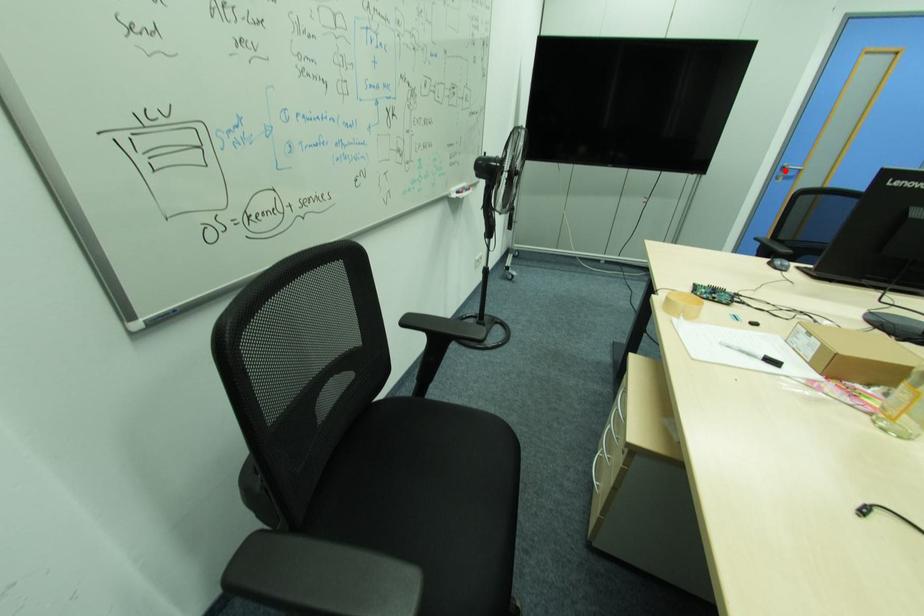
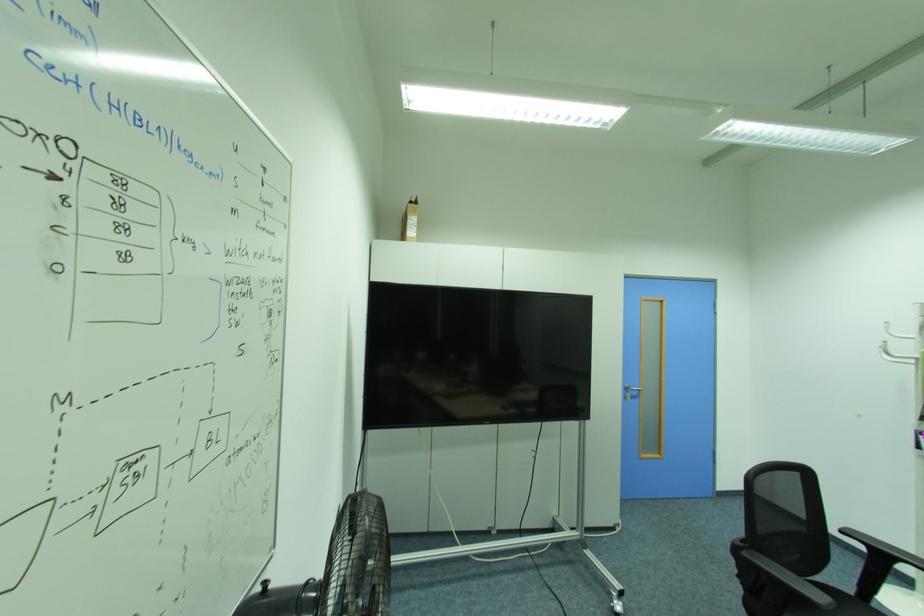
Find the pixel in the second image that matches the highlighted location in the first image.

(629, 390)